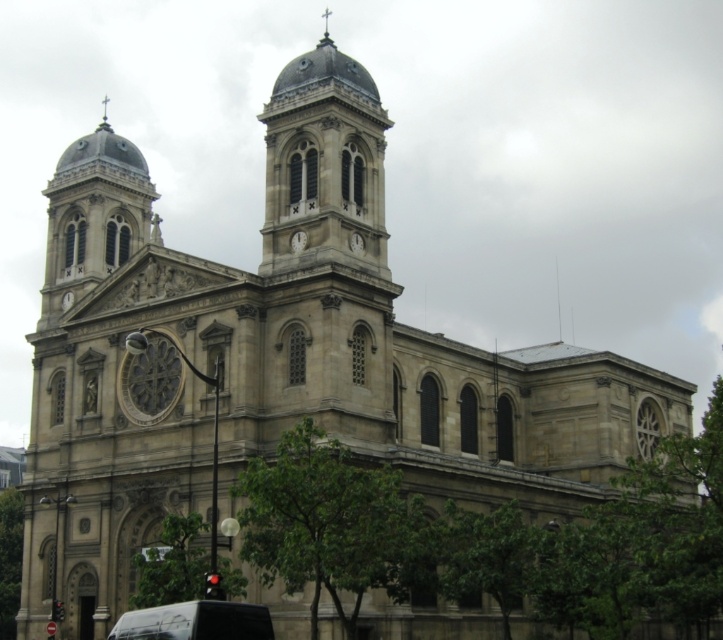
Consider the image. Can you confirm if white stone clock at center is taller than matte gray clock at upper center?

Indeed, white stone clock at center has a greater height compared to matte gray clock at upper center.

Who is taller, white stone clock at center or matte gray clock at upper center?

With more height is white stone clock at center.

Does point (303, 230) come in front of point (356, 243)?

Yes.

This screenshot has height=640, width=723. In order to click on white stone clock at center in this screenshot , I will do `click(299, 241)`.

Can you confirm if smooth stone clock tower at center is bigger than stone dome at center?

No, smooth stone clock tower at center is not bigger than stone dome at center.

Is point (380, 228) farther from viewer compared to point (54, 264)?

No.

This screenshot has width=723, height=640. What are the coordinates of `smooth stone clock tower at center` in the screenshot? It's located at (325, 163).

Between smooth stone clock tower at center and black matte van at lower center, which one appears on the left side from the viewer's perspective?

From the viewer's perspective, black matte van at lower center appears more on the left side.

Who is taller, smooth stone clock tower at center or black matte van at lower center?

smooth stone clock tower at center is taller.

You are a GUI agent. You are given a task and a screenshot of the screen. Output one action in this format:
    pyautogui.click(x=<x>, y=<y>)
    Task: Click on the smooth stone clock tower at center
    This screenshot has height=640, width=723.
    Given the screenshot: What is the action you would take?
    pyautogui.click(x=325, y=163)